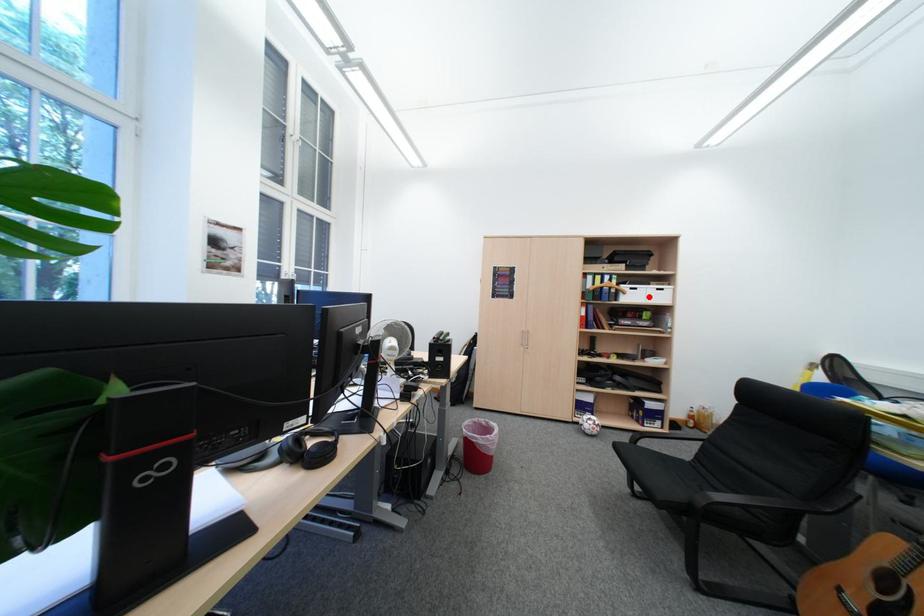
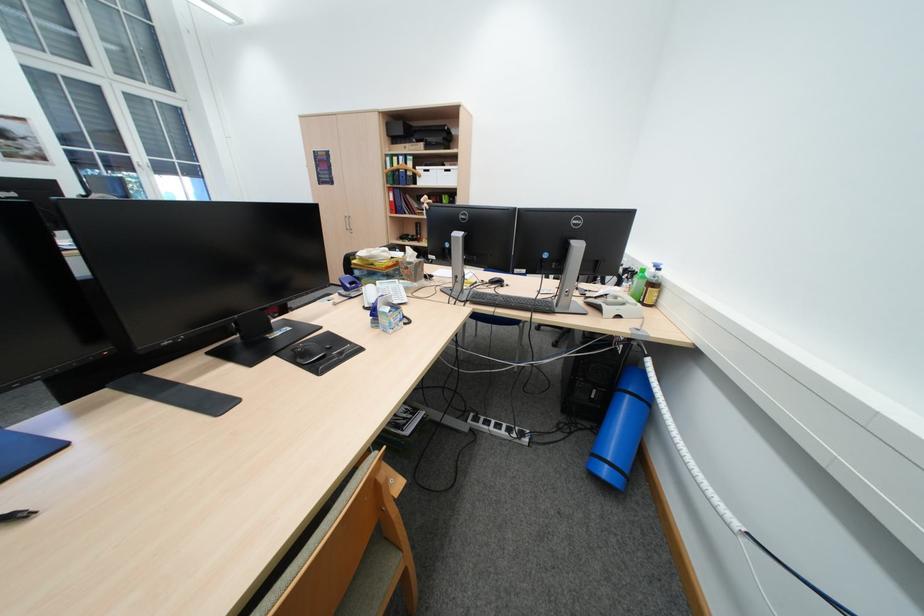
Question: I am providing you with two images of the same scene from different viewpoints. In image1, a red point is highlighted. Considering the same 3D point in image2, which of the following is correct?

Choices:
 (A) It is closer
 (B) It is farther

Answer: (A)